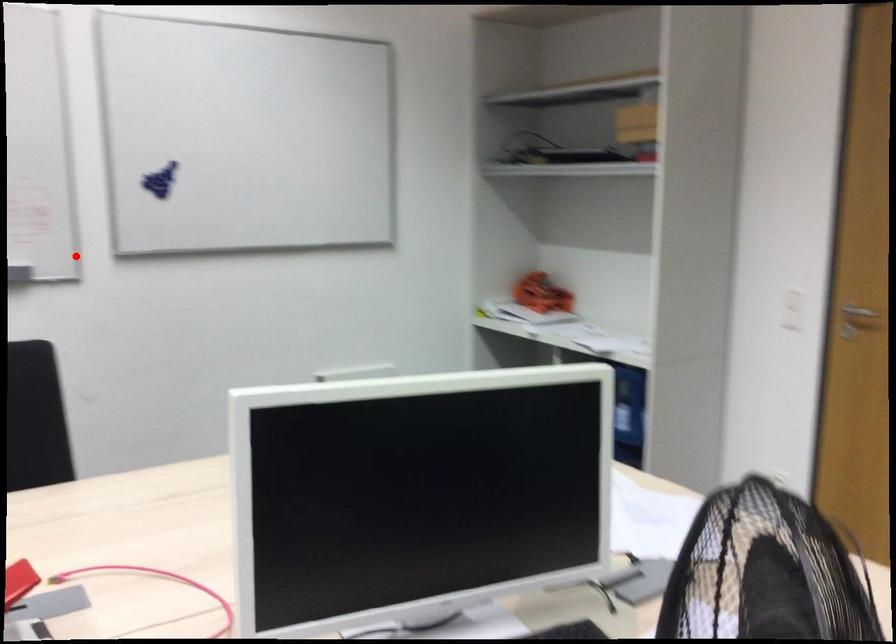
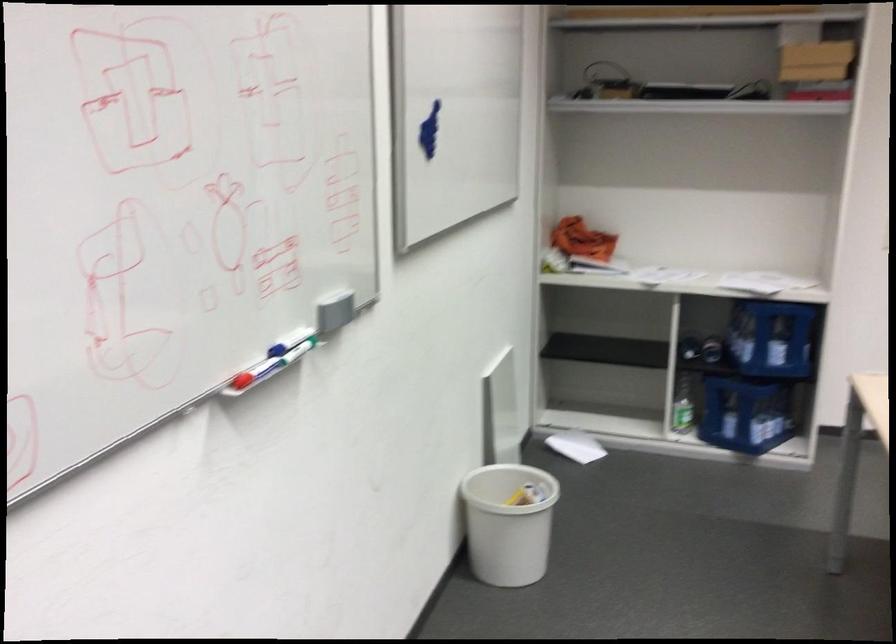
Where in the second image is the point corresponding to the highlighted location from the first image?

(334, 310)